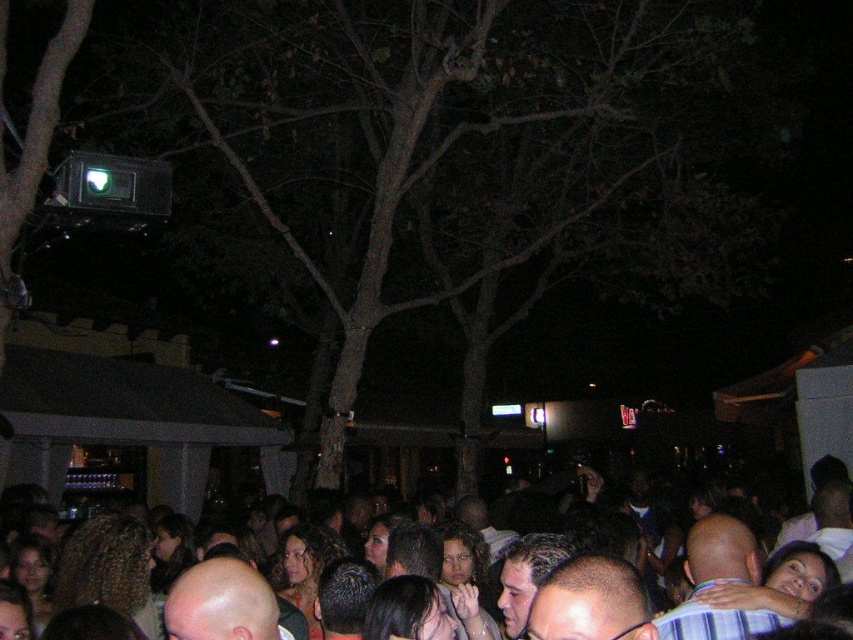
Question: From the image, what is the correct spatial relationship of shiny bald head at center in relation to bald head at center?

Choices:
 (A) left
 (B) right

Answer: (B)

Question: Among these points, which one is nearest to the camera?

Choices:
 (A) (585, 244)
 (B) (264, 588)
 (C) (590, 592)
 (D) (693, 579)

Answer: (C)

Question: Is brown bark tree at upper center wider than striped shirt at center?

Choices:
 (A) yes
 (B) no

Answer: (B)

Question: Does striped shirt at center have a smaller size compared to shiny bald head at center?

Choices:
 (A) yes
 (B) no

Answer: (B)

Question: Which point appears farthest from the camera in this image?

Choices:
 (A) (718, 516)
 (B) (248, 589)
 (C) (276, 0)
 (D) (735, 563)

Answer: (C)

Question: Which of the following is the closest to the observer?

Choices:
 (A) (688, 541)
 (B) (502, 228)

Answer: (A)